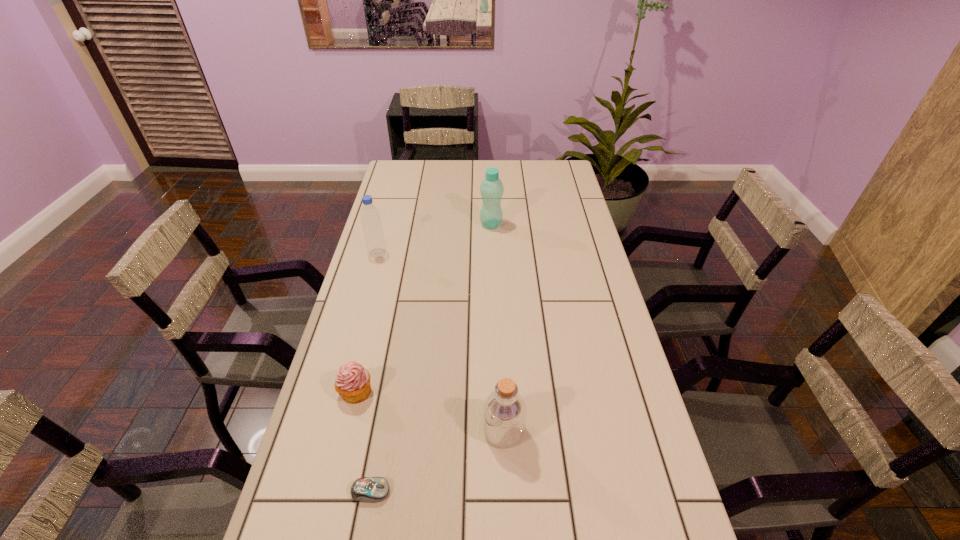
Identify the location of the second farthest object. (370, 217).

Image resolution: width=960 pixels, height=540 pixels. I want to click on the second nearest bottle, so click(x=370, y=217).

Find the location of a particular element. This screenshot has height=540, width=960. the farthest bottle is located at coordinates (491, 189).

The width and height of the screenshot is (960, 540). What are the coordinates of `the third tallest object` in the screenshot? It's located at (504, 413).

You are a GUI agent. You are given a task and a screenshot of the screen. Output one action in this format:
    pyautogui.click(x=<x>, y=<y>)
    Task: Click on the shortest bottle
    The height and width of the screenshot is (540, 960).
    Given the screenshot: What is the action you would take?
    pyautogui.click(x=504, y=413)

The width and height of the screenshot is (960, 540). Identify the location of the third farthest object. coord(352,383).

Locate an element on the screen. the second shortest object is located at coordinates (352, 383).

Where is `the shortest object`? the shortest object is located at coordinates (365, 489).

I want to click on the nearest object, so click(x=365, y=489).

Image resolution: width=960 pixels, height=540 pixels. Identify the location of free space located on the back of the leftmost bottle. (389, 213).